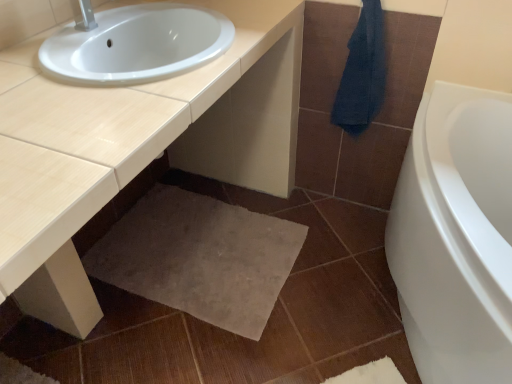
Find the location of a particular element. free location to the right of beige carpet at lower center is located at coordinates (333, 263).